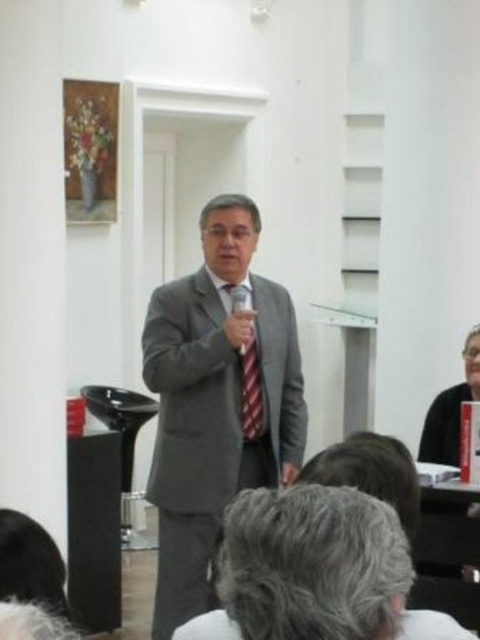
Does black fabric at lower right appear on the right side of red striped tie at center?

Yes, black fabric at lower right is to the right of red striped tie at center.

From the picture: Can you confirm if black fabric at lower right is wider than red striped tie at center?

Correct, the width of black fabric at lower right exceeds that of red striped tie at center.

The image size is (480, 640). What do you see at coordinates (451, 410) in the screenshot?
I see `black fabric at lower right` at bounding box center [451, 410].

You are a GUI agent. You are given a task and a screenshot of the screen. Output one action in this format:
    pyautogui.click(x=<x>, y=<y>)
    Task: Click on the black fabric at lower right
    Image resolution: width=480 pixels, height=640 pixels.
    Given the screenshot: What is the action you would take?
    pyautogui.click(x=451, y=410)

Does matte gray suit at center appear on the left side of gray hair at lower center?

No, matte gray suit at center is not to the left of gray hair at lower center.

Is matte gray suit at center further to camera compared to gray hair at lower center?

Yes, matte gray suit at center is further from the viewer.

Is point (214, 346) positioned before point (4, 529)?

That is False.

The image size is (480, 640). What are the coordinates of `matte gray suit at center` in the screenshot? It's located at (216, 403).

Which is below, gray hair at lower center or red striped tie at center?

gray hair at lower center is lower down.

Is gray hair at lower center closer to the viewer compared to red striped tie at center?

Yes.

The width and height of the screenshot is (480, 640). What do you see at coordinates (31, 563) in the screenshot?
I see `gray hair at lower center` at bounding box center [31, 563].

Where is `gray hair at lower center`? The image size is (480, 640). gray hair at lower center is located at coordinates (31, 563).